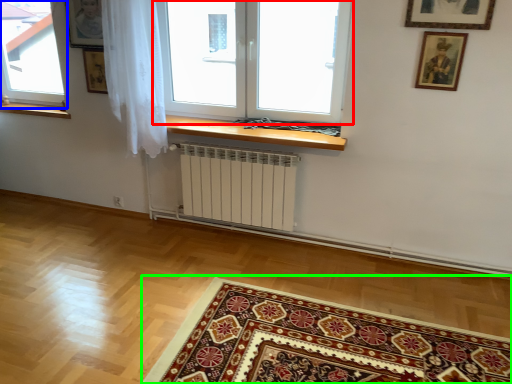
Question: Which object is the closest to the window (highlighted by a red box)? Choose among these: window (highlighted by a blue box) or mat (highlighted by a green box).

Choices:
 (A) window
 (B) mat

Answer: (B)